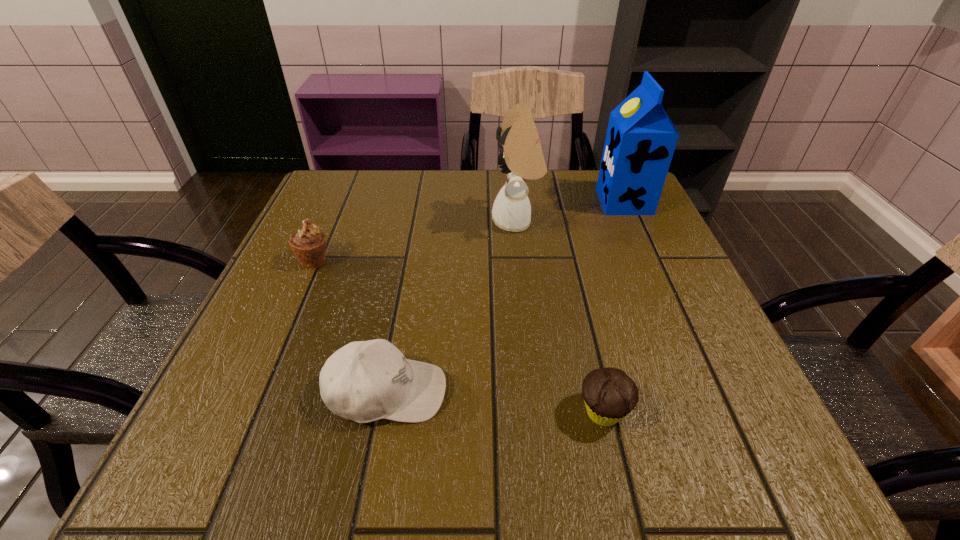
You are a GUI agent. You are given a task and a screenshot of the screen. Output one action in this format:
    pyautogui.click(x=<x>, y=<y>)
    Task: Click on the rightmost object
    This screenshot has width=960, height=540.
    Given the screenshot: What is the action you would take?
    pyautogui.click(x=640, y=141)

Where is `doll`? This screenshot has width=960, height=540. doll is located at coordinates (521, 157).

This screenshot has height=540, width=960. I want to click on the taller muffin, so tap(308, 244).

Where is `the third nearest object`? Image resolution: width=960 pixels, height=540 pixels. the third nearest object is located at coordinates tap(308, 244).

Identify the location of baseball cap. (364, 381).

This screenshot has height=540, width=960. What are the coordinates of `the second object from right to left` in the screenshot? It's located at (609, 394).

Locate an element on the screen. the shortest object is located at coordinates (609, 394).

Locate an element on the screen. free location located 0.360m with the cap open on the carton is located at coordinates (455, 202).

You are a GUI agent. You are given a task and a screenshot of the screen. Output one action in this format:
    pyautogui.click(x=<x>, y=<y>)
    Task: Click on the vacant space positioned with the cap open on the carton
    Image resolution: width=960 pixels, height=540 pixels.
    Given the screenshot: What is the action you would take?
    [560, 202]

Image resolution: width=960 pixels, height=540 pixels. Identify the location of vacant space located with the cap open on the carton. (479, 202).